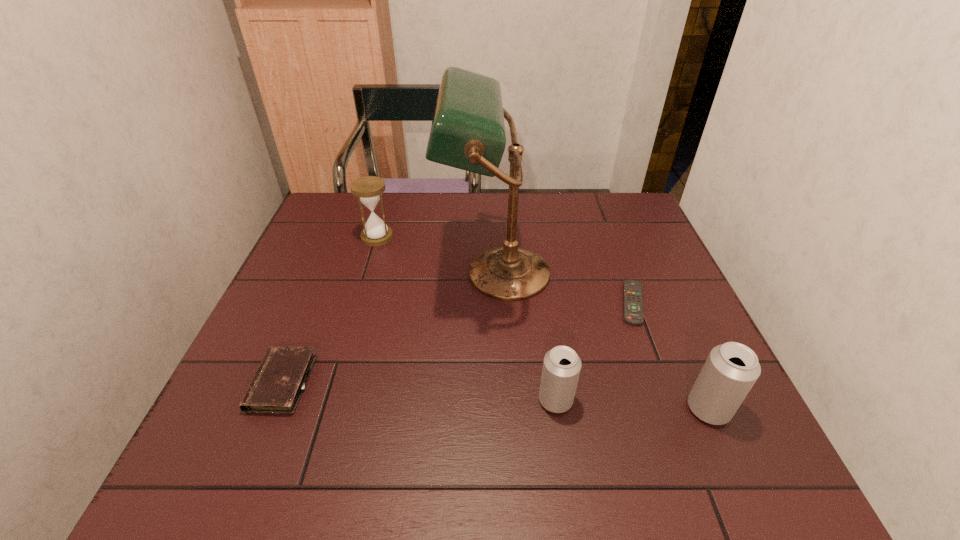
The image size is (960, 540). I want to click on vacant region at the far right corner of the desktop, so click(606, 224).

Where is `free space at the near right corner`? free space at the near right corner is located at coordinates (705, 428).

This screenshot has width=960, height=540. I want to click on vacant region between the shortest object and the right beer can, so click(671, 356).

Find the location of a particular element. This screenshot has width=960, height=540. free space between the hourglass and the second shortest object is located at coordinates (329, 310).

Locate an element on the screen. The image size is (960, 540). vacant area that lies between the shortest object and the right beer can is located at coordinates (671, 356).

Locate an element on the screen. The image size is (960, 540). vacant space in between the third shortest object and the fifth tallest object is located at coordinates [419, 392].

Find the location of a particular element. This screenshot has width=960, height=540. vacant space that is in between the taller beer can and the tallest object is located at coordinates (602, 341).

Where is `free space between the hourglass and the shorter beer can`? The width and height of the screenshot is (960, 540). free space between the hourglass and the shorter beer can is located at coordinates (467, 319).

You are a GUI agent. You are given a task and a screenshot of the screen. Output one action in this format:
    pyautogui.click(x=<x>, y=<y>)
    Task: Click on the free space between the shortest object and the fifth tallest object
    
    Given the screenshot: What is the action you would take?
    pyautogui.click(x=457, y=343)

Where is `vacant point located between the taller beer can and the fourth tallest object`? vacant point located between the taller beer can and the fourth tallest object is located at coordinates (632, 404).